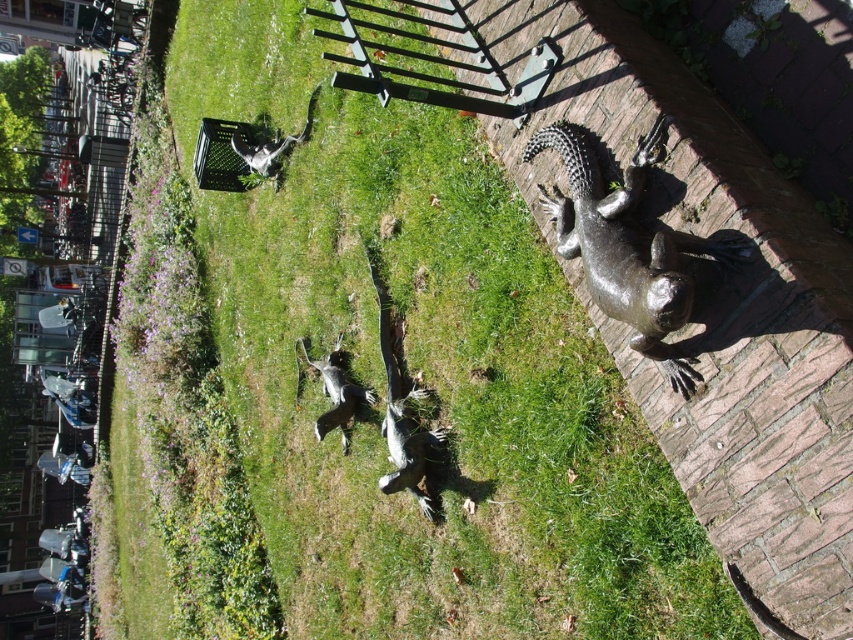
You are a visitor in the park and want to take a photo of the shiny bronze iguana at right and the shiny silver statue at center. Which one should you focus on first if you are moving from left to right across the grassy area?

Since the shiny bronze iguana at right is to the right of the shiny silver statue at center, you should focus on the shiny silver statue at center first as you move from left to right.

You are a sculptor who wants to place a new small sculpture between the shiny bronze iguana at right and the shiny silver statue at upper left. Which existing sculpture should you use as a reference for the size of your new sculpture to ensure it fits proportionally?

The shiny silver statue at upper left is smaller, so the new sculpture should be sized similarly to it to maintain proportion between the shiny bronze iguana at right and the shiny silver statue at upper left.